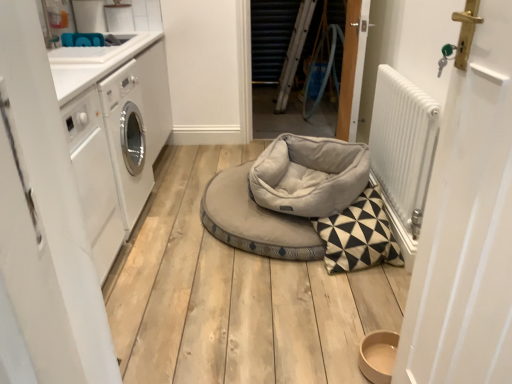
Question: From the image's perspective, is light gray fabric dog bed at center, the second dog bed from the front, beneath wooden door at center, which is the 1th door from right to left?

Choices:
 (A) yes
 (B) no

Answer: (A)

Question: Is light gray fabric dog bed at center, which is the first dog bed in back-to-front order, smaller than wooden door at center, the second door in the back-to-front sequence?

Choices:
 (A) no
 (B) yes

Answer: (A)

Question: From a real-world perspective, is light gray fabric dog bed at center, which is the first dog bed in back-to-front order, on wooden door at center, the fourth door in the left-to-right sequence?

Choices:
 (A) yes
 (B) no

Answer: (B)

Question: Considering the relative positions of light gray fabric dog bed at center, the second dog bed from the front, and wooden door at center, which is the third door in front-to-back order, in the image provided, is light gray fabric dog bed at center, the second dog bed from the front, to the right of wooden door at center, which is the third door in front-to-back order, from the viewer's perspective?

Choices:
 (A) no
 (B) yes

Answer: (A)

Question: Is light gray fabric dog bed at center, the second dog bed from the front, bigger than wooden door at center, which is the 1th door from right to left?

Choices:
 (A) no
 (B) yes

Answer: (B)

Question: Would you say light gray fabric dog bed at center, which is the first dog bed in back-to-front order, contains wooden door at center, the second door in the back-to-front sequence?

Choices:
 (A) no
 (B) yes

Answer: (A)

Question: Is white glossy countertop at upper left far from wooden door at center, which is the third door in front-to-back order?

Choices:
 (A) yes
 (B) no

Answer: (A)

Question: From the image's perspective, is white glossy countertop at upper left located above wooden door at center, the second door in the back-to-front sequence?

Choices:
 (A) no
 (B) yes

Answer: (B)

Question: Is white glossy countertop at upper left directly adjacent to wooden door at center, the second door in the back-to-front sequence?

Choices:
 (A) yes
 (B) no

Answer: (B)

Question: Is white glossy countertop at upper left to the left of wooden door at center, the fourth door in the left-to-right sequence, from the viewer's perspective?

Choices:
 (A) no
 (B) yes

Answer: (B)

Question: From a real-world perspective, is white glossy countertop at upper left beneath wooden door at center, the second door in the back-to-front sequence?

Choices:
 (A) yes
 (B) no

Answer: (B)

Question: From the image's perspective, is white glossy countertop at upper left beneath wooden door at center, the fourth door in the left-to-right sequence?

Choices:
 (A) no
 (B) yes

Answer: (A)

Question: From a real-world perspective, is white matte door at left, acting as the first door starting from the left, positioned over white glossy countertop at upper left based on gravity?

Choices:
 (A) yes
 (B) no

Answer: (B)